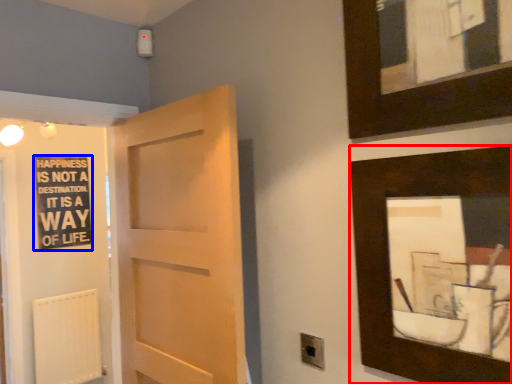
Question: Among these objects, which one is farthest to the camera, picture frame (highlighted by a red box) or bulletin board (highlighted by a blue box)?

Choices:
 (A) picture frame
 (B) bulletin board

Answer: (B)